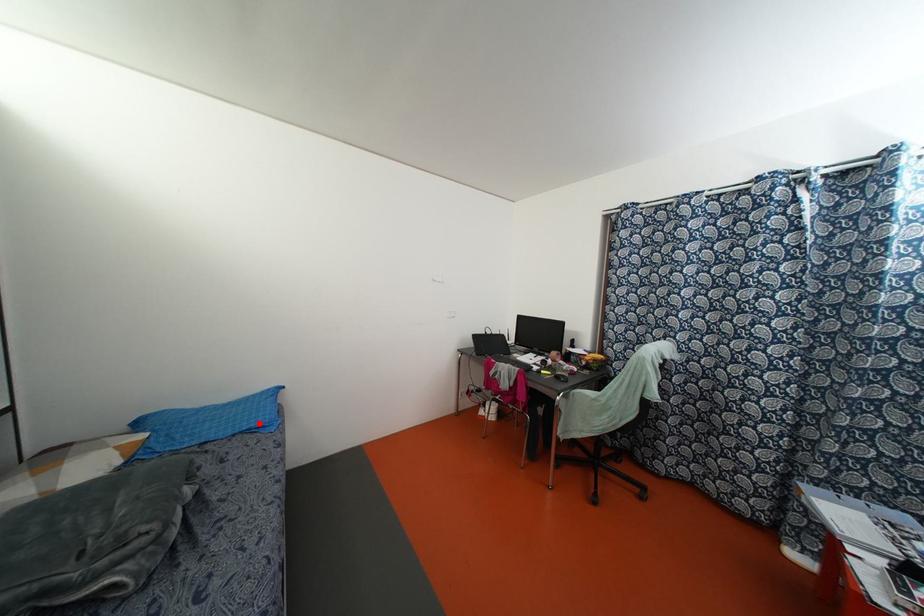
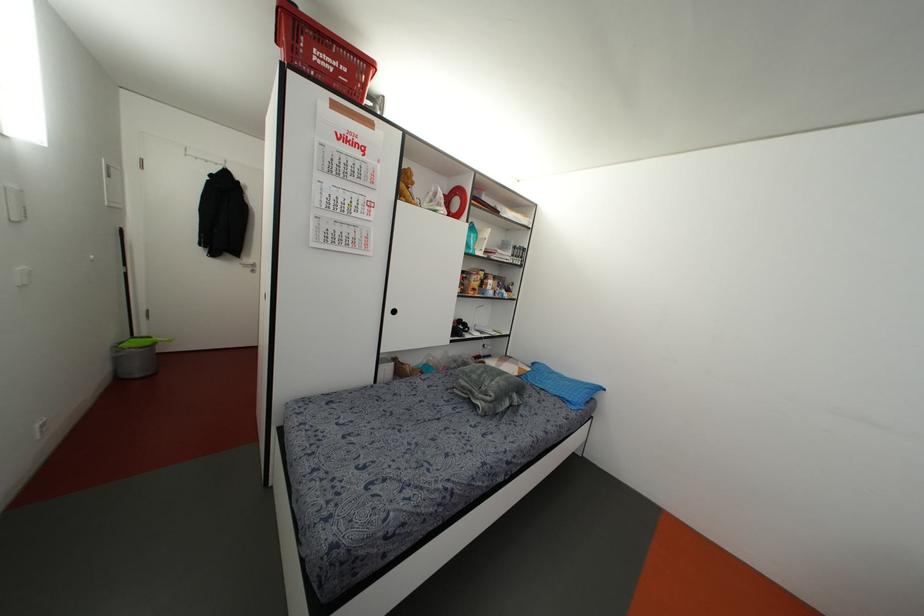
In the second image, find the point that corresponds to the highlighted location in the first image.

(569, 399)